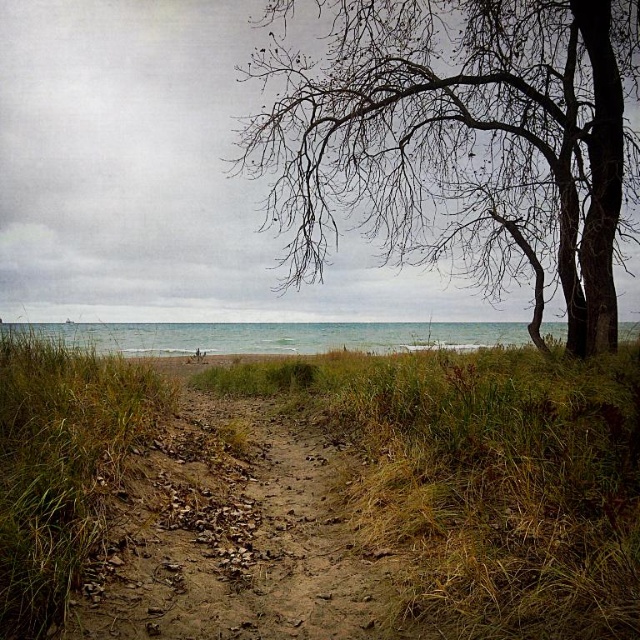
Question: Among these points, which one is farthest from the camera?

Choices:
 (A) (310, 499)
 (B) (342, 429)
 (C) (124, 333)
 (D) (336, 29)

Answer: (C)

Question: Does bare branches at upper center appear under green grass at center?

Choices:
 (A) yes
 (B) no

Answer: (B)

Question: Considering the real-world distances, which object is closest to the green grass at center?

Choices:
 (A) bare branches at upper center
 (B) brown dirt track at center
 (C) clear water at lower center

Answer: (B)

Question: Which point is closer to the camera?

Choices:
 (A) green grass at center
 (B) clear water at lower center

Answer: (A)

Question: Can you confirm if brown dirt track at center is wider than clear water at lower center?

Choices:
 (A) yes
 (B) no

Answer: (B)

Question: Does green grass at center lie in front of brown dirt track at center?

Choices:
 (A) yes
 (B) no

Answer: (A)